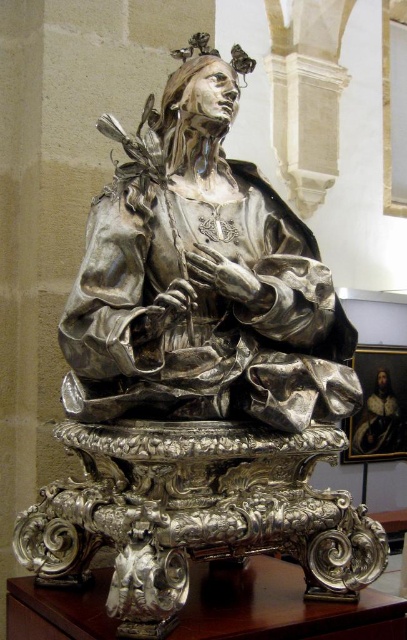
Question: Is shiny silver statue at center positioned at the back of silver statue at center?

Choices:
 (A) yes
 (B) no

Answer: (B)

Question: Among these points, which one is farthest from the camera?

Choices:
 (A) (404, 419)
 (B) (247, 337)

Answer: (A)

Question: Is shiny silver statue at center wider than silver statue at center?

Choices:
 (A) yes
 (B) no

Answer: (A)

Question: Which point is farther to the camera?

Choices:
 (A) silver statue at center
 (B) shiny silver statue at center

Answer: (A)

Question: Which object appears closest to the camera in this image?

Choices:
 (A) shiny silver statue at center
 (B) silver statue at center

Answer: (A)

Question: Can you confirm if shiny silver statue at center is smaller than silver statue at center?

Choices:
 (A) yes
 (B) no

Answer: (B)